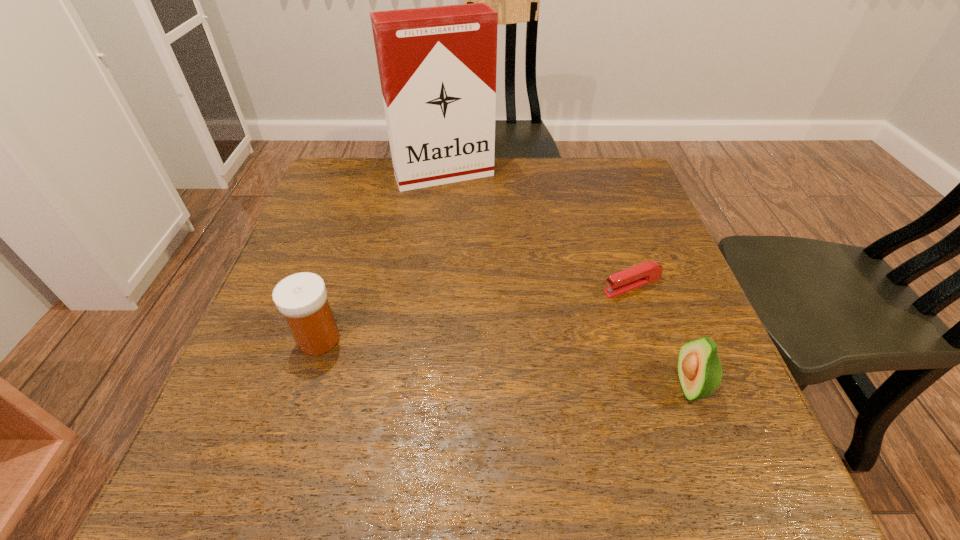
The height and width of the screenshot is (540, 960). I want to click on the second nearest object, so click(301, 298).

Locate an element on the screen. the leftmost object is located at coordinates (301, 298).

Locate an element on the screen. This screenshot has height=540, width=960. the nearest object is located at coordinates (699, 368).

Find the location of a particular element. cigarette_case is located at coordinates (437, 65).

Image resolution: width=960 pixels, height=540 pixels. Find the location of `the third object from right to left`. the third object from right to left is located at coordinates (437, 65).

Find the location of a particular element. stapler is located at coordinates (647, 272).

In order to click on the shortest object in this screenshot , I will do `click(647, 272)`.

Identify the location of free space located 0.070m on the left of the second nearest object. This screenshot has height=540, width=960. (260, 339).

Identify the location of vacant space located 0.160m on the cut side of the nearest object. The image size is (960, 540). (582, 386).

You are a GUI agent. You are given a task and a screenshot of the screen. Output one action in this format:
    pyautogui.click(x=<x>, y=<y>)
    Task: Click on the free space located 0.090m on the cut side of the nearest object
    This screenshot has height=540, width=960.
    Given the screenshot: What is the action you would take?
    pyautogui.click(x=622, y=386)